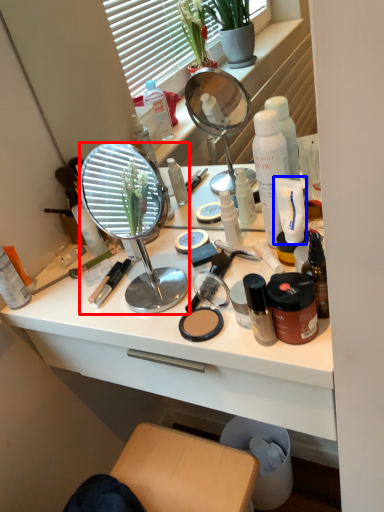
Question: Which point is further to the camera, mirror (highlighted by a red box) or product (highlighted by a blue box)?

Choices:
 (A) mirror
 (B) product

Answer: (B)